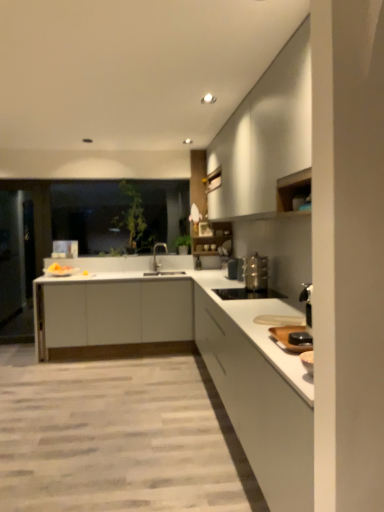
Question: Does white matte cabinet at upper right, positioned as the first cabinetry in top-to-bottom order, turn towards white matte countertop at center?

Choices:
 (A) yes
 (B) no

Answer: (B)

Question: From the image's perspective, is white matte cabinet at upper right, positioned as the first cabinetry in top-to-bottom order, located beneath white matte countertop at center?

Choices:
 (A) yes
 (B) no

Answer: (B)

Question: Can white matte countertop at center be found inside white matte cabinet at upper right, positioned as the first cabinetry in top-to-bottom order?

Choices:
 (A) no
 (B) yes

Answer: (A)

Question: Is the surface of white matte cabinet at upper right, the third cabinetry in the bottom-to-top sequence, in direct contact with white matte countertop at center?

Choices:
 (A) yes
 (B) no

Answer: (B)

Question: From the image's perspective, is white matte cabinet at upper right, the third cabinetry in the bottom-to-top sequence, on white matte countertop at center?

Choices:
 (A) no
 (B) yes

Answer: (B)

Question: Is white matte cabinet at upper right, positioned as the first cabinetry in top-to-bottom order, smaller than white matte countertop at center?

Choices:
 (A) yes
 (B) no

Answer: (B)

Question: Does transparent glass window at center have a lesser height compared to satin silver toaster at lower right, the first appliance from the bottom?

Choices:
 (A) yes
 (B) no

Answer: (B)

Question: Is transparent glass window at center at the left side of satin silver toaster at lower right, the first appliance from the bottom?

Choices:
 (A) no
 (B) yes

Answer: (B)

Question: Considering the relative positions of transparent glass window at center and satin silver toaster at lower right, arranged as the 2th appliance when viewed from the top, in the image provided, is transparent glass window at center to the right of satin silver toaster at lower right, arranged as the 2th appliance when viewed from the top, from the viewer's perspective?

Choices:
 (A) yes
 (B) no

Answer: (B)

Question: Is transparent glass window at center oriented towards satin silver toaster at lower right, arranged as the 2th appliance when viewed from the top?

Choices:
 (A) no
 (B) yes

Answer: (B)

Question: Is transparent glass window at center positioned with its back to satin silver toaster at lower right, arranged as the 2th appliance when viewed from the top?

Choices:
 (A) no
 (B) yes

Answer: (A)

Question: Is transparent glass window at center touching satin silver toaster at lower right, the first appliance from the bottom?

Choices:
 (A) yes
 (B) no

Answer: (B)

Question: From the image's perspective, is satin silver toaster at lower right, the first appliance from the bottom, above white matte countertop at center?

Choices:
 (A) yes
 (B) no

Answer: (A)